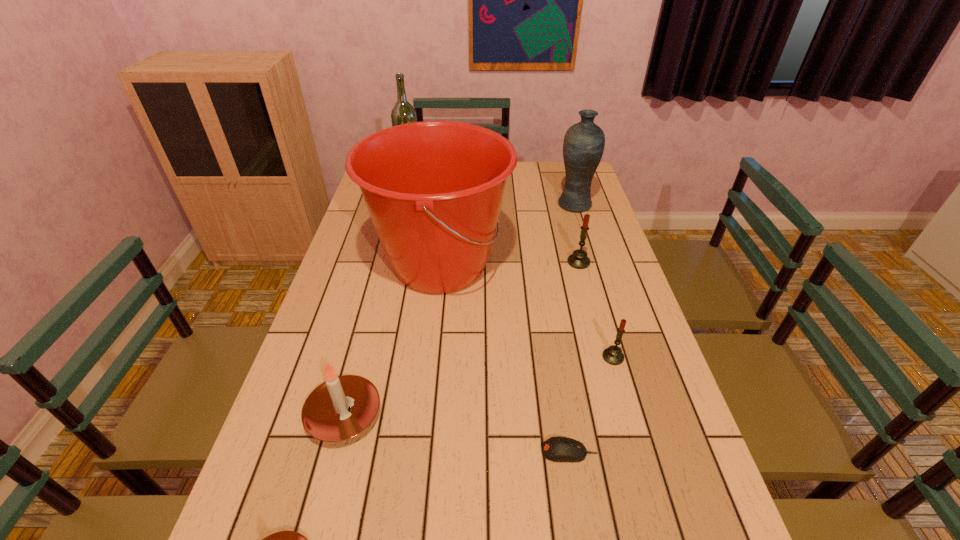
Where is `the smaller red candle`? This screenshot has height=540, width=960. the smaller red candle is located at coordinates (613, 355).

Find the location of a particular element. computer mouse is located at coordinates (558, 449).

Locate an element on the screen. the fifth object from left to right is located at coordinates (558, 449).

Locate an element on the screen. vacant space situated 0.080m on the front of the liquor is located at coordinates (407, 194).

Locate an element on the screen. Image resolution: width=960 pixels, height=540 pixels. free location located with the handle attached to the rim of the red bucket is located at coordinates (598, 266).

At what (x,y) coordinates should I click in order to perform the action: click on vacant region located 0.090m on the back of the blue vase. Please return your answer as a coordinate pair (x, y). Looking at the image, I should click on (568, 183).

You are a GUI agent. You are given a task and a screenshot of the screen. Output one action in this format:
    pyautogui.click(x=<x>, y=<y>)
    Task: Click on the vacant space located 0.200m on the left of the farther red candle
    
    Given the screenshot: What is the action you would take?
    pyautogui.click(x=504, y=262)

Locate an element on the screen. This screenshot has height=540, width=960. free point located 0.370m on the right of the second nearest candle is located at coordinates (547, 414).

Where is `free space located on the front of the fifth farthest object`? Image resolution: width=960 pixels, height=540 pixels. free space located on the front of the fifth farthest object is located at coordinates coord(622,389).

Identify the location of free spot located 0.060m on the right of the computer mouse. (626, 451).